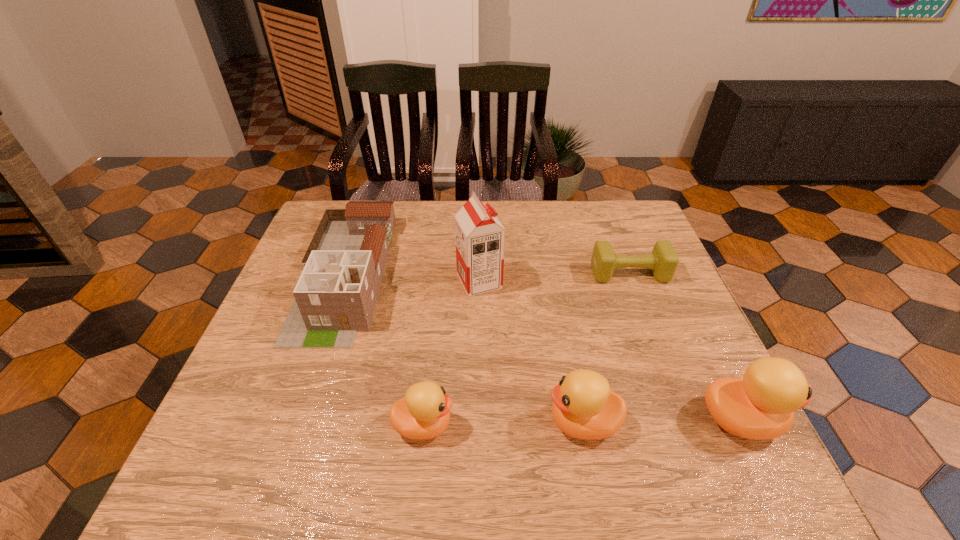
Find the location of `free location located on the face of the third object from right to left`. free location located on the face of the third object from right to left is located at coordinates click(x=443, y=422).

Where is `free space located on the face of the third object from right to left`? The width and height of the screenshot is (960, 540). free space located on the face of the third object from right to left is located at coordinates (507, 422).

You are a GUI agent. You are given a task and a screenshot of the screen. Output one action in this format:
    pyautogui.click(x=<x>, y=<y>)
    Task: Click on the vacant space located 0.370m on the left of the soya milk
    This screenshot has width=960, height=540.
    Given the screenshot: What is the action you would take?
    pyautogui.click(x=322, y=281)

Identify the location of free region located at the main entrance of the dollhouse. (295, 422).

Locate an element on the screen. The image size is (960, 540). free space located on the front of the dumbbell is located at coordinates (x=652, y=332).

The height and width of the screenshot is (540, 960). Find the location of `object present at the far edge`. object present at the far edge is located at coordinates (335, 297).

What are the coordinates of `object located at the left edge` in the screenshot? It's located at (335, 297).

Find the location of a particular element. duckling present at the right edge is located at coordinates (761, 405).

I want to click on dumbbell present at the right edge, so click(x=663, y=261).

What are the coordinates of `object at the far left corner` in the screenshot? It's located at (335, 297).